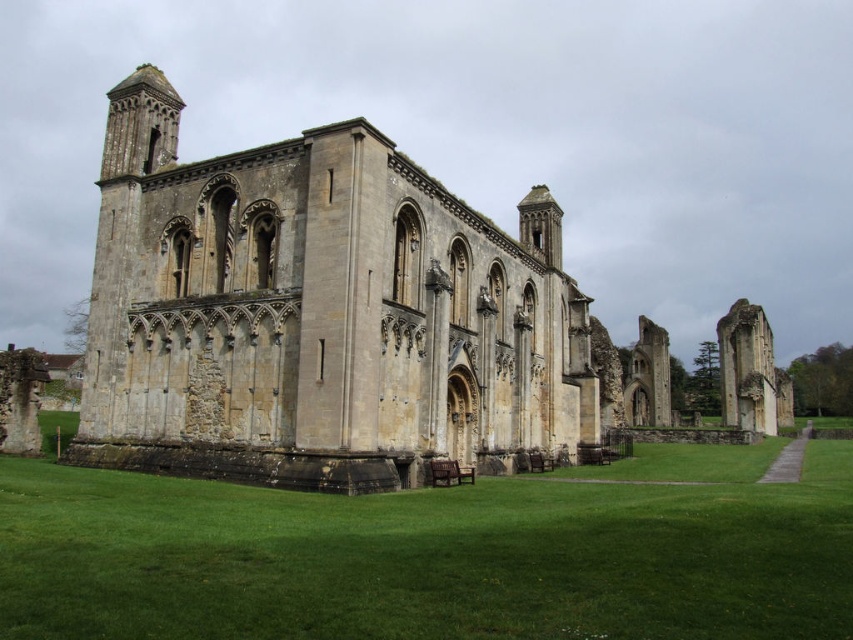
Can you confirm if yellow stone ruins at center is shorter than green grass at lower center?

Incorrect, yellow stone ruins at center's height does not fall short of green grass at lower center's.

Does yellow stone ruins at center have a larger size compared to green grass at lower center?

Correct, yellow stone ruins at center is larger in size than green grass at lower center.

In order to click on yellow stone ruins at center in this screenshot , I will do `click(355, 321)`.

The image size is (853, 640). Find the location of `yellow stone ruins at center`. yellow stone ruins at center is located at coordinates (355, 321).